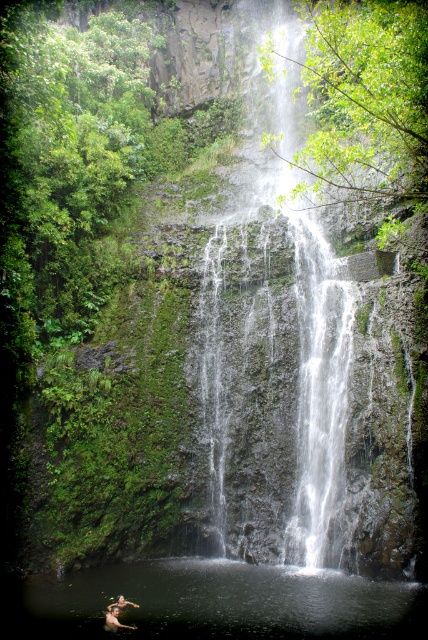
Can you confirm if clear water at center is positioned to the right of smooth skin person at lower left?

Indeed, clear water at center is positioned on the right side of smooth skin person at lower left.

Is clear water at center bigger than smooth skin person at lower left?

Yes, clear water at center is bigger than smooth skin person at lower left.

The width and height of the screenshot is (428, 640). I want to click on clear water at center, so click(225, 602).

Is white textured water at center to the right of clear water at center from the viewer's perspective?

Correct, you'll find white textured water at center to the right of clear water at center.

Which is in front, point (341, 490) or point (79, 572)?

Point (79, 572) is more forward.

Which is behind, point (256, 257) or point (250, 611)?

The point (256, 257) is more distant.

Find the location of a particular element. This screenshot has height=640, width=428. white textured water at center is located at coordinates (273, 376).

Is point (165, 589) in front of point (112, 618)?

No, (165, 589) is further to viewer.

Is clear water at center taller than skinny person at lower center?

Yes, clear water at center is taller than skinny person at lower center.

At what (x,y) coordinates should I click in order to perform the action: click on clear water at center. Please return your answer as a coordinate pair (x, y). Image resolution: width=428 pixels, height=640 pixels. Looking at the image, I should click on (225, 602).

At what (x,y) coordinates should I click in order to perform the action: click on clear water at center. Please return your answer as a coordinate pair (x, y). Looking at the image, I should click on (225, 602).